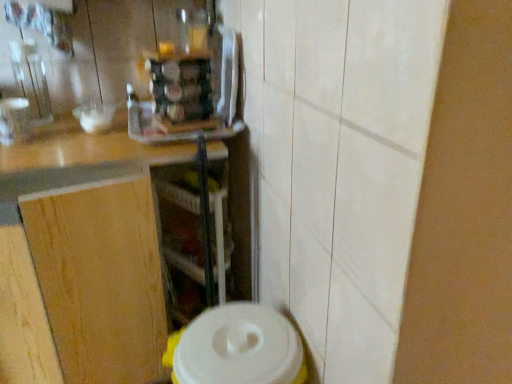
Question: Does transparent plastic shelf at center have a larger size compared to wooden at left?

Choices:
 (A) no
 (B) yes

Answer: (A)

Question: From the image's perspective, is transparent plastic shelf at center below wooden at left?

Choices:
 (A) no
 (B) yes

Answer: (B)

Question: From a real-world perspective, is transparent plastic shelf at center physically below wooden at left?

Choices:
 (A) no
 (B) yes

Answer: (B)

Question: Considering the relative sizes of transparent plastic shelf at center and wooden at left in the image provided, is transparent plastic shelf at center taller than wooden at left?

Choices:
 (A) yes
 (B) no

Answer: (B)

Question: Is transparent plastic shelf at center positioned beyond the bounds of wooden at left?

Choices:
 (A) yes
 (B) no

Answer: (B)

Question: Is transparent plastic shelf at center at the right side of wooden at left?

Choices:
 (A) no
 (B) yes

Answer: (B)

Question: Is white plastic container at lower center taller than wooden at left?

Choices:
 (A) no
 (B) yes

Answer: (A)

Question: Does white plastic container at lower center turn towards wooden at left?

Choices:
 (A) yes
 (B) no

Answer: (B)

Question: From the image's perspective, is white plastic container at lower center above wooden at left?

Choices:
 (A) no
 (B) yes

Answer: (A)

Question: Is white plastic container at lower center not within wooden at left?

Choices:
 (A) yes
 (B) no

Answer: (A)

Question: Does white plastic container at lower center come behind wooden at left?

Choices:
 (A) yes
 (B) no

Answer: (B)

Question: Can you confirm if white plastic container at lower center is smaller than wooden at left?

Choices:
 (A) no
 (B) yes

Answer: (B)

Question: Considering the relative positions of wooden at left and white plastic container at lower center in the image provided, is wooden at left to the left of white plastic container at lower center from the viewer's perspective?

Choices:
 (A) yes
 (B) no

Answer: (A)